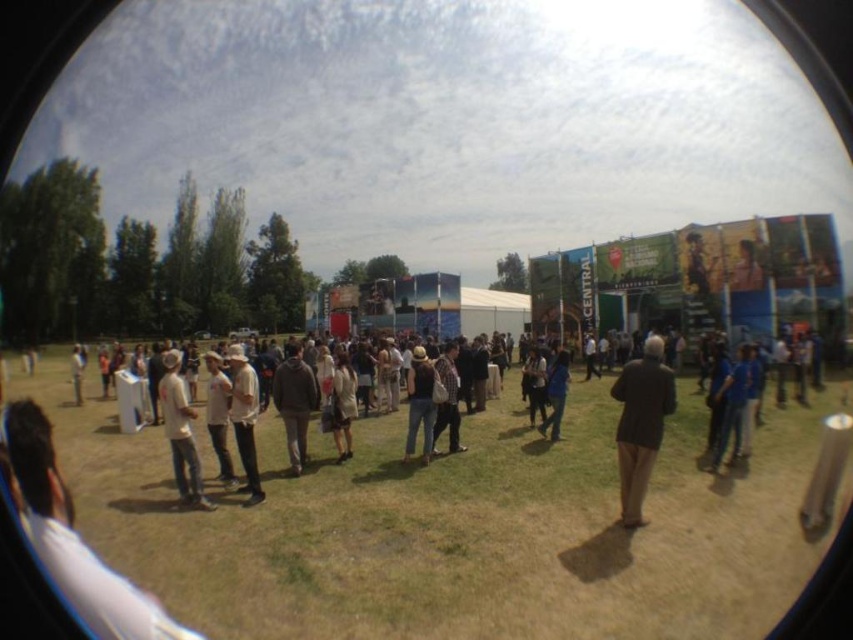
Is point (201, 481) farther from viewer compared to point (561, 349)?

No, (201, 481) is closer to viewer.

Consider the image. Is white cotton shirt at lower left below blue denim jeans at center?

Incorrect, white cotton shirt at lower left is not positioned below blue denim jeans at center.

Does point (164, 401) come farther from viewer compared to point (561, 388)?

That is False.

At what (x,y) coordinates should I click in order to perform the action: click on white cotton shirt at lower left. Please return your answer as a coordinate pair (x, y). Looking at the image, I should click on (180, 432).

Who is shorter, dark brown jacket at center or blue denim jeans at center?

blue denim jeans at center is shorter.

Looking at this image, can you confirm if dark brown jacket at center is taller than blue denim jeans at center?

Yes.

Between point (310, 388) and point (544, 428), which one is positioned behind?

The point (544, 428) is behind.

The height and width of the screenshot is (640, 853). Identify the location of dark brown jacket at center. 294,403.

Who is higher up, denim jacket at center or light beige coat at center?

denim jacket at center is above.

Is denim jacket at center taller than light beige coat at center?

Yes, denim jacket at center is taller than light beige coat at center.

Is point (409, 394) positioned behind point (334, 378)?

Yes, point (409, 394) is behind point (334, 378).

The height and width of the screenshot is (640, 853). I want to click on denim jacket at center, so click(x=421, y=403).